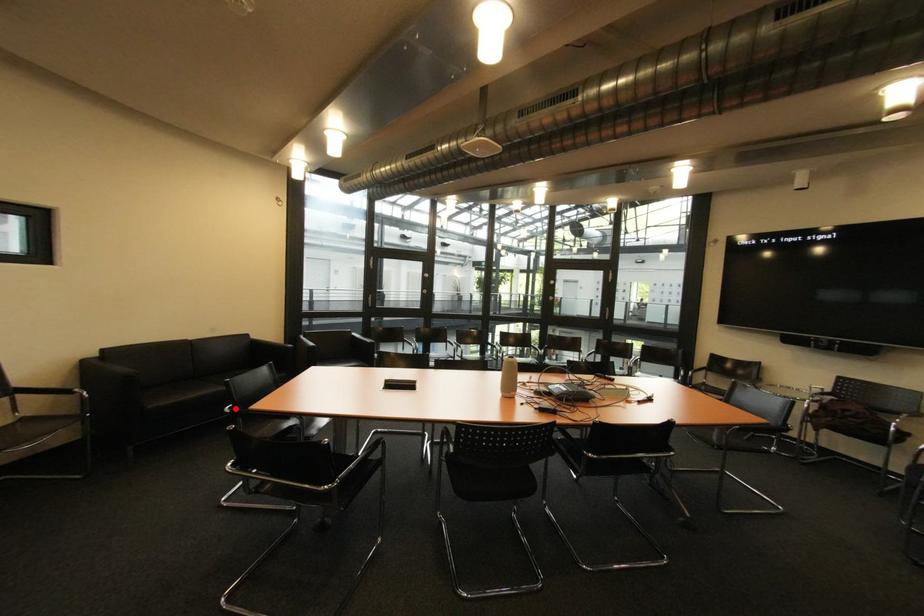
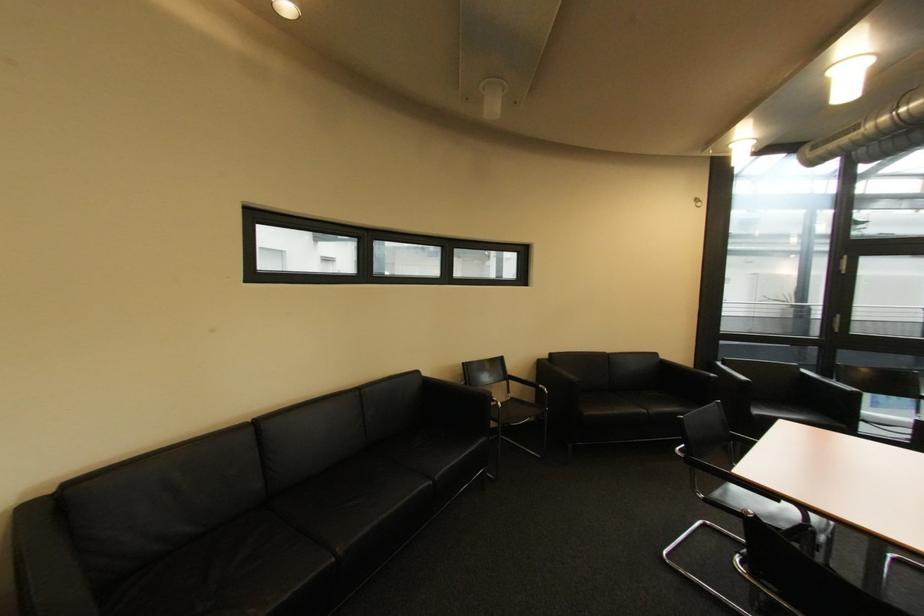
Question: A red point is marked in image1. In image2, is the corresponding 3D point closer to the camera or farther? Reply with the corresponding letter.

Choices:
 (A) The corresponding 3D point is closer.
 (B) The corresponding 3D point is farther.

Answer: (A)